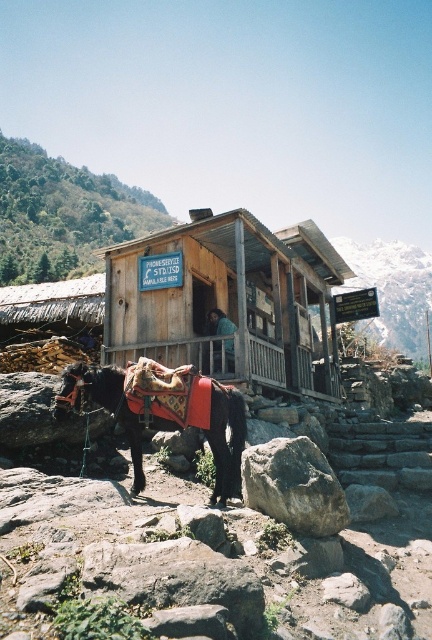
Question: Among these objects, which one is nearest to the camera?

Choices:
 (A) smooth gray rock at lower center
 (B) smooth wooden door at center
 (C) wooden hut at center
 (D) shiny brown horse at lower left

Answer: (A)

Question: Based on their relative distances, which object is farther from the smooth gray rock at lower center?

Choices:
 (A) gray rough rock at lower center
 (B) shiny brown horse at lower left
 (C) smooth wooden door at center
 (D) wooden hut at center

Answer: (D)

Question: Considering the relative positions of shiny brown horse at lower left and smooth wooden door at center in the image provided, where is shiny brown horse at lower left located with respect to smooth wooden door at center?

Choices:
 (A) above
 (B) below

Answer: (B)

Question: Which object appears farthest from the camera in this image?

Choices:
 (A) shiny brown horse at lower left
 (B) gray rough rock at lower center
 (C) smooth gray rock at lower center

Answer: (A)

Question: Considering the relative positions of smooth gray rock at lower center and gray rough rock at lower center in the image provided, where is smooth gray rock at lower center located with respect to gray rough rock at lower center?

Choices:
 (A) below
 (B) above

Answer: (A)

Question: Can you confirm if smooth gray rock at lower center is positioned to the right of smooth wooden door at center?

Choices:
 (A) yes
 (B) no

Answer: (A)